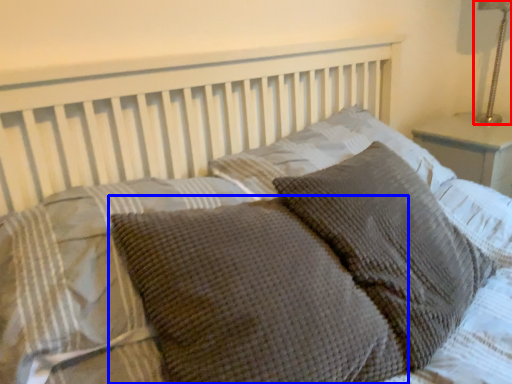
Question: Which object is further to the camera taking this photo, bedside lamp (highlighted by a red box) or pillow (highlighted by a blue box)?

Choices:
 (A) bedside lamp
 (B) pillow

Answer: (A)